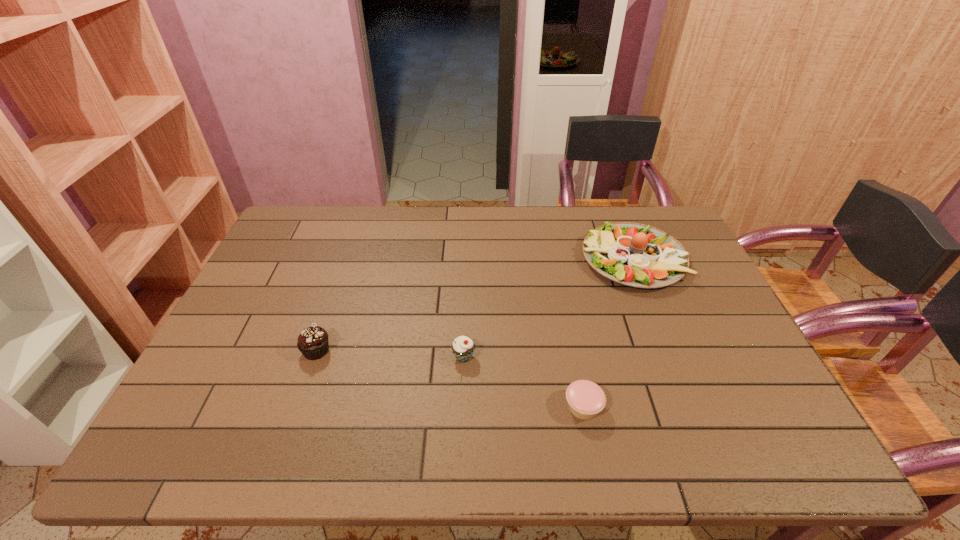
Locate an element on the screen. The image size is (960, 540). object that is at the far edge is located at coordinates (637, 255).

Identify the location of object that is at the near edge. The height and width of the screenshot is (540, 960). (586, 399).

Locate an element on the screen. object located in the right edge section of the desktop is located at coordinates (637, 255).

This screenshot has height=540, width=960. I want to click on object that is at the far right corner, so click(x=637, y=255).

The height and width of the screenshot is (540, 960). In order to click on vacant space at the far edge of the desktop in this screenshot , I will do `click(367, 230)`.

You are a GUI agent. You are given a task and a screenshot of the screen. Output one action in this format:
    pyautogui.click(x=<x>, y=<y>)
    Task: Click on the vacant space at the near edge of the desktop
    This screenshot has height=540, width=960.
    Given the screenshot: What is the action you would take?
    pyautogui.click(x=345, y=427)

Locate an element on the screen. vacant space at the left edge of the desktop is located at coordinates (225, 332).

Find the location of a particular element. vacant point at the right edge is located at coordinates (689, 259).

I want to click on vacant region between the second object from left to right and the rightmost object, so click(x=548, y=308).

Locate an element on the screen. This screenshot has width=960, height=540. free spot between the third object from right to left and the leftmost cupcake is located at coordinates (390, 354).